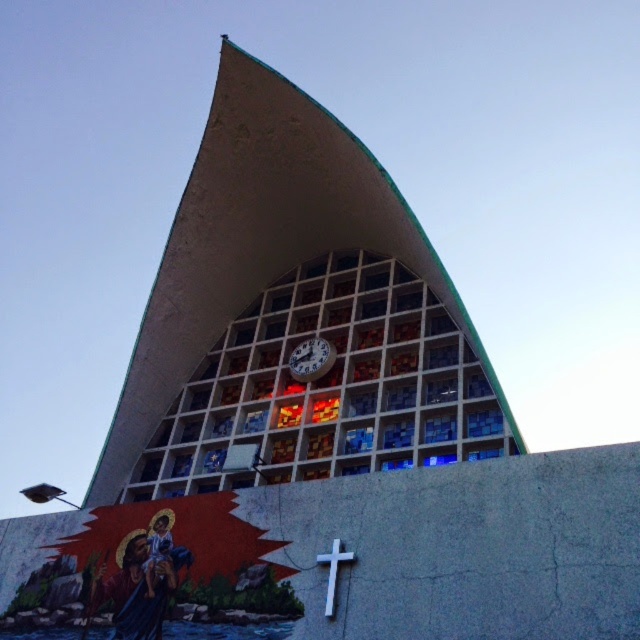
You are an architect designing a new building and want to place a decorative element exactly at the point specified in the scene. Which object is located at point (328, 387)?

The stained glass at center is located at point (328, 387).

From the picture: You are an architect analyzing the building design. You need to determine which object at the center has a greater width between the stained glass at center and the metallic clock at center based on the architectural plans. Which one is wider?

The stained glass at center has a greater width than the metallic clock at center according to the architectural plans.

You are standing in front of the modern church building and want to place a small flower bouquet between the metallic clock at center and the white matte cross at center. According to the spatial arrangement, where should you place the bouquet?

The metallic clock at center is above the white matte cross at center, so you should place the bouquet between them by positioning it below the metallic clock at center and above the white matte cross at center.